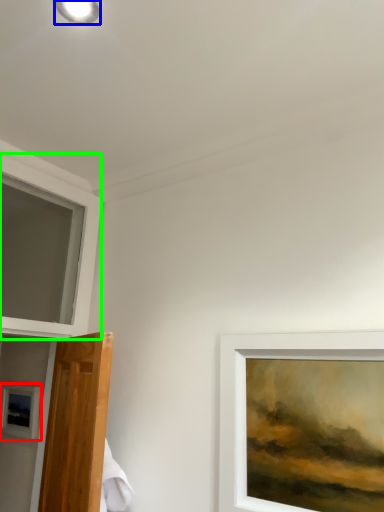
Question: Which object is the closest to the picture frame (highlighted by a red box)? Choose among these: droplight (highlighted by a blue box) or window (highlighted by a green box).

Choices:
 (A) droplight
 (B) window

Answer: (B)